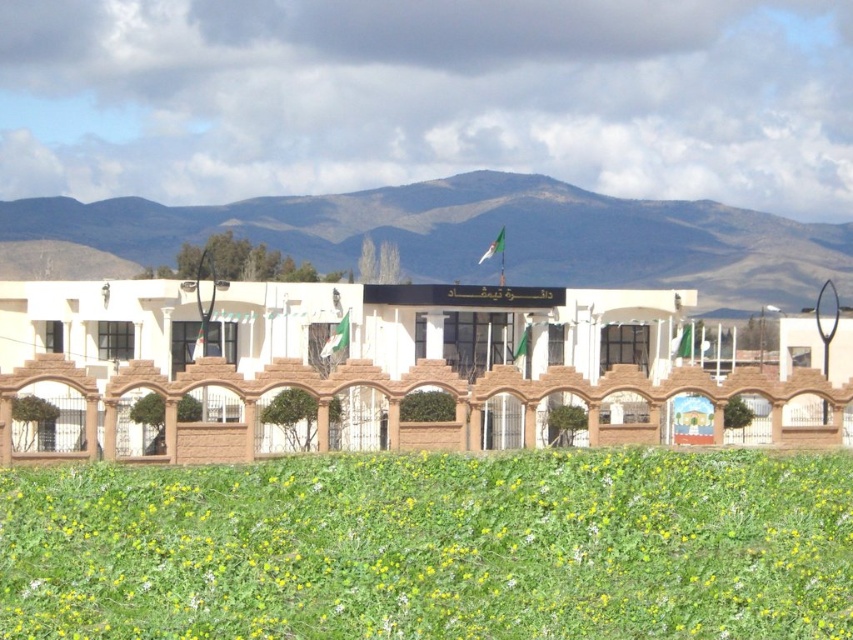
Question: Is green grass at lower center below white brick building at center?

Choices:
 (A) no
 (B) yes

Answer: (B)

Question: Is green grass at lower center further to camera compared to brown rocky mountain at upper center?

Choices:
 (A) no
 (B) yes

Answer: (A)

Question: Based on their relative distances, which object is nearer to the white brick building at center?

Choices:
 (A) brown rocky mountain at upper center
 (B) green grass at lower center

Answer: (B)

Question: Among these points, which one is farthest from the camera?

Choices:
 (A) (444, 628)
 (B) (27, 333)
 (C) (809, 269)

Answer: (C)

Question: Which object is closer to the camera taking this photo?

Choices:
 (A) white brick building at center
 (B) brown rocky mountain at upper center
 (C) green grass at lower center

Answer: (C)

Question: Does green grass at lower center lie in front of white brick building at center?

Choices:
 (A) yes
 (B) no

Answer: (A)